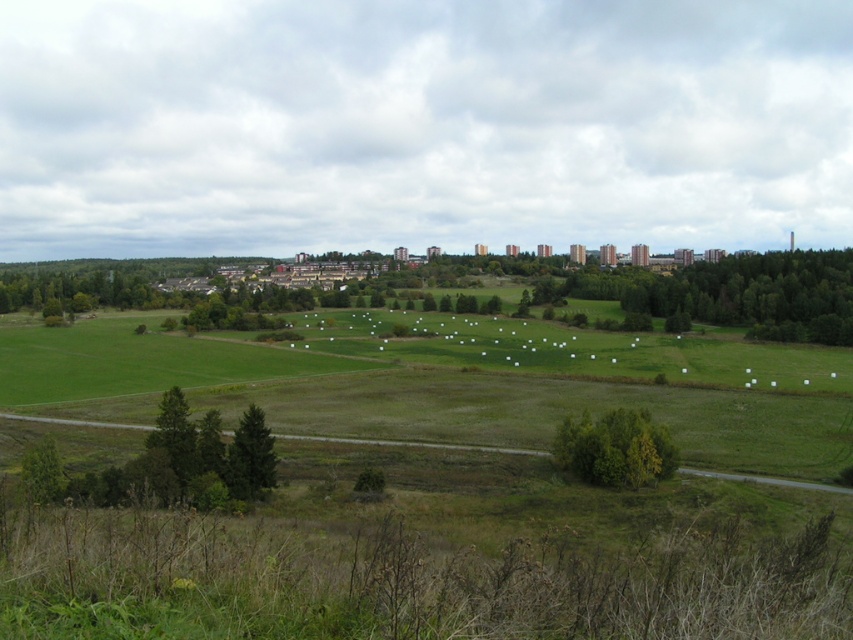
In the scene shown: You are standing at the origin point in the image. You see two points marked as point 1 at coordinates point (260,410) and point 2 at coordinates point (57,452). Which point is closer to you?

Point 2 at coordinates point (57,452) is closer to you because it is in front of point 1 at coordinates point (260,410).

You are standing in the open landscape and want to walk towards the green leafy tree at center and the green matte tree at lower left. Which tree will you reach first?

You will reach the green leafy tree at center first because it is closer to you than the green matte tree at lower left, which is further away.

Based on the photo, you are standing in the open landscape and want to find the tallest tree among the green matte tree at lower left and the green leafy tree at lower left. Which one should you look up to?

The green matte tree at lower left is much taller than the green leafy tree at lower left, so you should look up at the green matte tree at lower left.